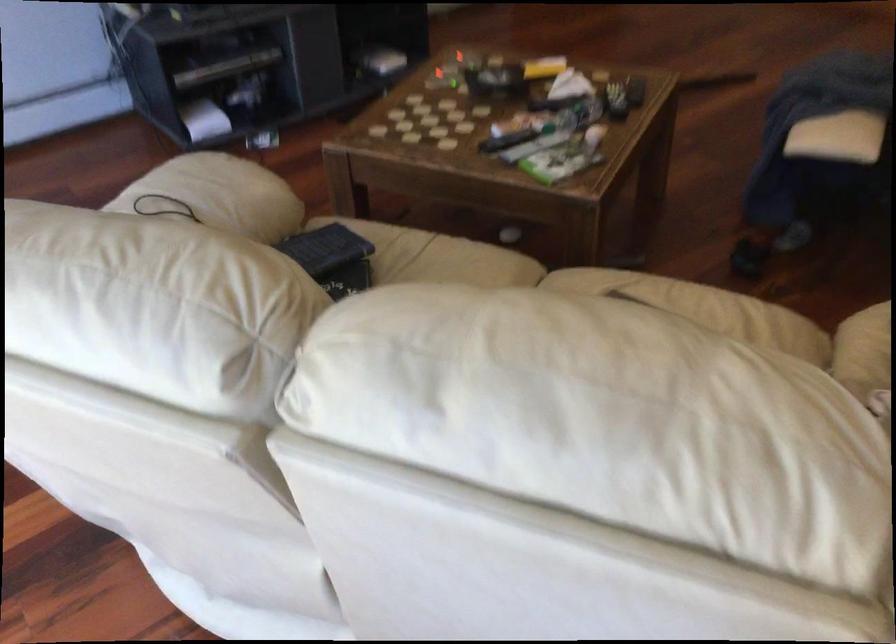
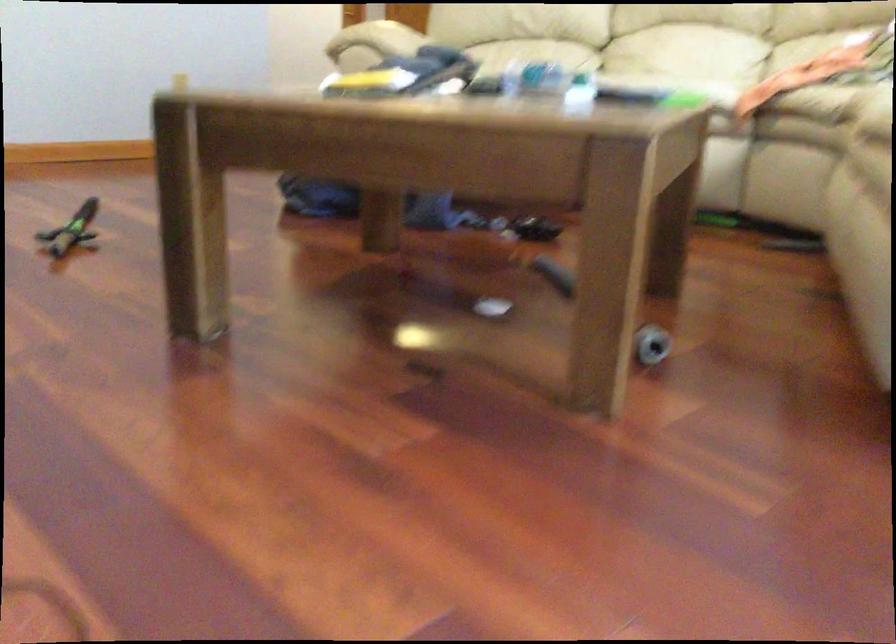
In the second image, find the point that corresponds to the point at 495,122 in the first image.

(580, 93)